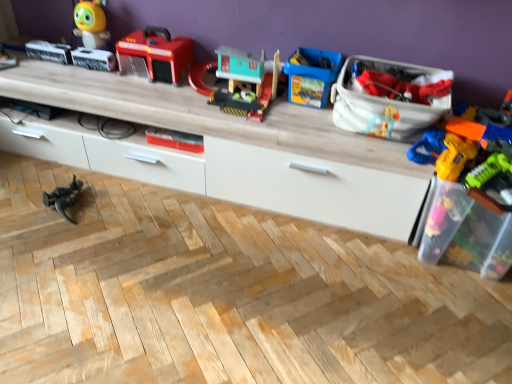
Where is `free spot above wooden entertainment center at upper center (from a real-world perspective)`? The width and height of the screenshot is (512, 384). free spot above wooden entertainment center at upper center (from a real-world perspective) is located at coordinates (147, 84).